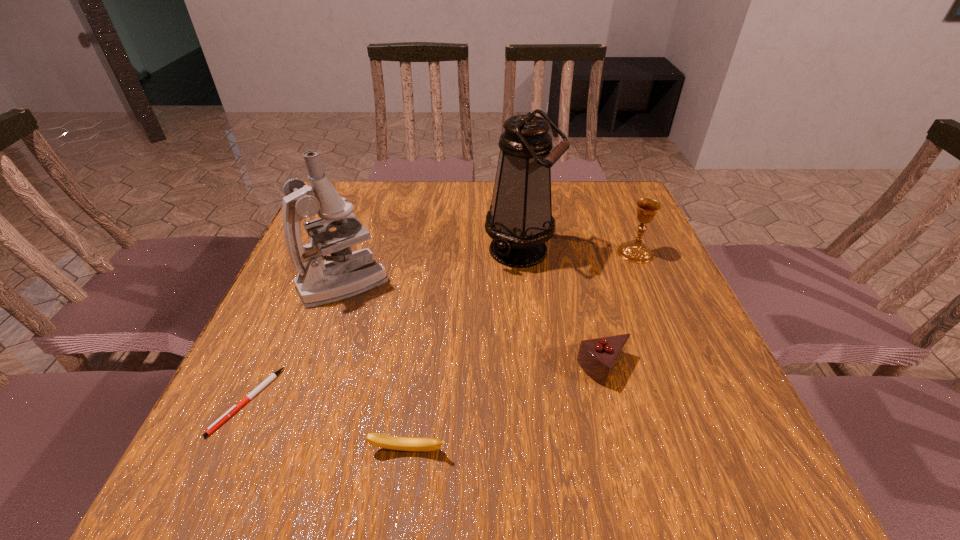
What are the coordinates of `vacant space located on the left of the fourth shortest object` in the screenshot? It's located at (545, 253).

The width and height of the screenshot is (960, 540). In order to click on vacant space located 0.260m on the left of the fourth tallest object in this screenshot , I will do `click(440, 369)`.

Image resolution: width=960 pixels, height=540 pixels. Identify the location of object that is positioned at the near edge. (379, 440).

The width and height of the screenshot is (960, 540). In order to click on microscope at the left edge in this screenshot , I will do `click(345, 273)`.

Identify the location of pen that is positioned at the left edge. This screenshot has height=540, width=960. (232, 410).

Locate an element on the screen. object present at the right edge is located at coordinates (635, 251).

You are a GUI agent. You are given a task and a screenshot of the screen. Output one action in this format:
    pyautogui.click(x=<x>, y=<y>)
    Task: Click on the free space at the far edge
    The height and width of the screenshot is (540, 960).
    Given the screenshot: What is the action you would take?
    pyautogui.click(x=580, y=219)

You are a GUI agent. You are given a task and a screenshot of the screen. Output one action in this format:
    pyautogui.click(x=<x>, y=<y>)
    Task: Click on the free space at the left edge of the desktop
    This screenshot has height=540, width=960.
    Given the screenshot: What is the action you would take?
    pyautogui.click(x=284, y=281)

Where is `free location at the right edge of the desktop`? free location at the right edge of the desktop is located at coordinates (684, 380).

In the image, there is a desktop. Where is `vacant region at the near left corner`? vacant region at the near left corner is located at coordinates (272, 453).